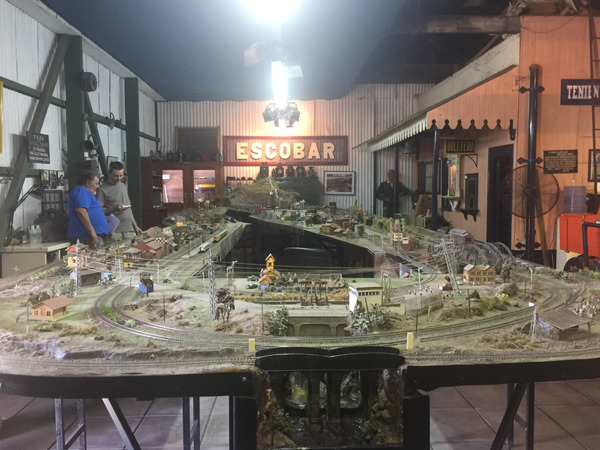
The height and width of the screenshot is (450, 600). I want to click on picture, so click(341, 187).